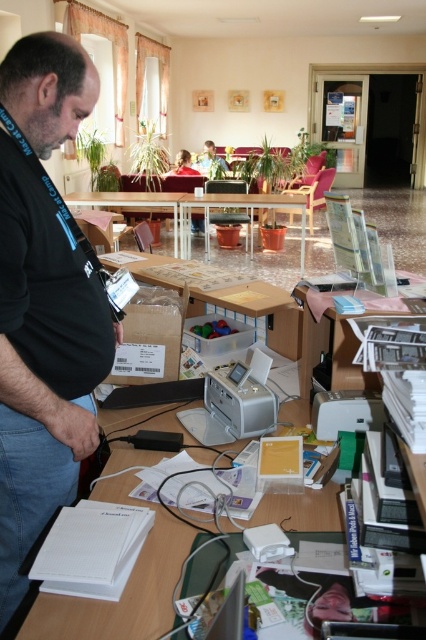
You are standing at the desk in the image. There are two points marked on the desk surface. The first point is at coordinate (258, 387) and the second point is at coordinate (324, 435). Which point is closer to you?

Point (324, 435) is closer to you because it is in front of point (258, 387).